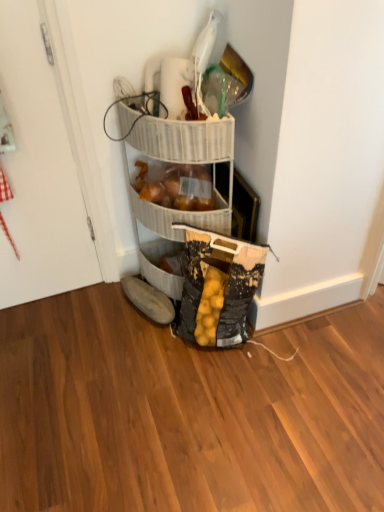
Question: From a real-world perspective, is white glossy door at left positioned above or below brown suede shoe at lower center?

Choices:
 (A) above
 (B) below

Answer: (A)

Question: Looking at the image, does white glossy door at left seem bigger or smaller compared to brown suede shoe at lower center?

Choices:
 (A) small
 (B) big

Answer: (B)

Question: Estimate the real-world distances between objects in this image. Which object is closer to the white glossy door at left?

Choices:
 (A) brown suede shoe at lower center
 (B) translucent plastic bag of onions at center

Answer: (B)

Question: Considering the real-world distances, which object is closest to the white glossy door at left?

Choices:
 (A) brown suede shoe at lower center
 (B) translucent plastic bag of onions at center

Answer: (B)